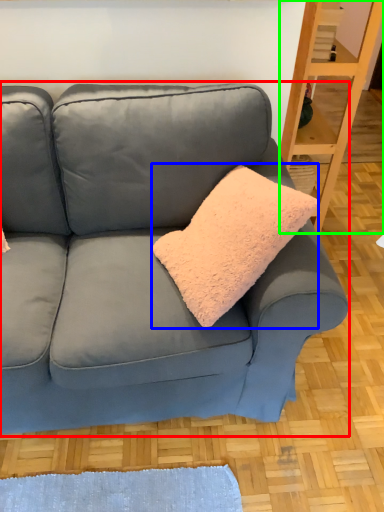
Question: Based on their relative distances, which object is nearer to studio couch (highlighted by a red box)? Choose from throw pillow (highlighted by a blue box) and shelf (highlighted by a green box).

Choices:
 (A) throw pillow
 (B) shelf

Answer: (A)